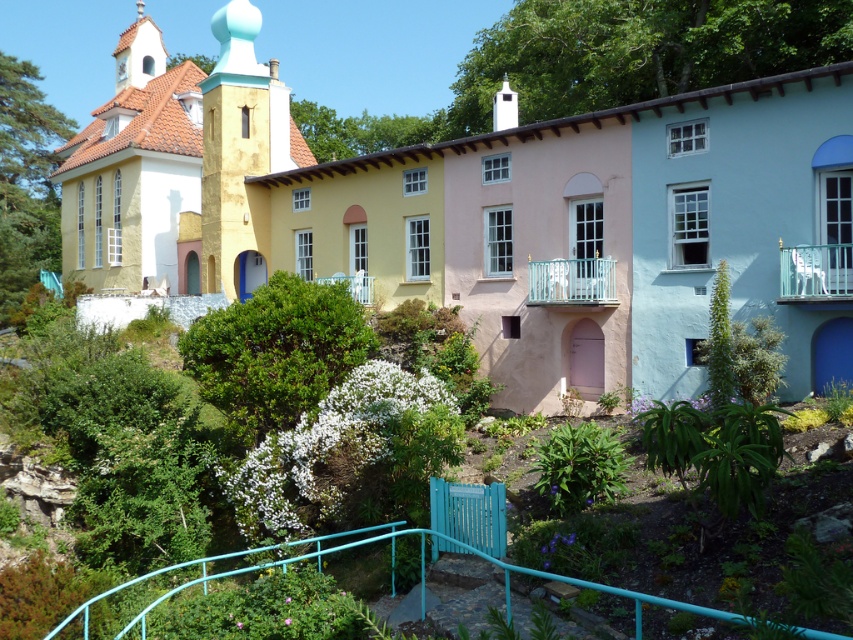
You are standing at the center of the garden in front of the building. Looking at the building, where is the matte yellow chapel at upper left located in terms of direction and position?

The matte yellow chapel at upper left is located at the upper left position of the building, at coordinates point (175,163).

You are a visitor standing in the garden and looking at the building. Which object, the matte yellow church at upper left or the teal metal railing at lower center, takes up more visual space in your view?

The matte yellow church at upper left takes up more visual space in your view because it is bigger than the teal metal railing at lower center.